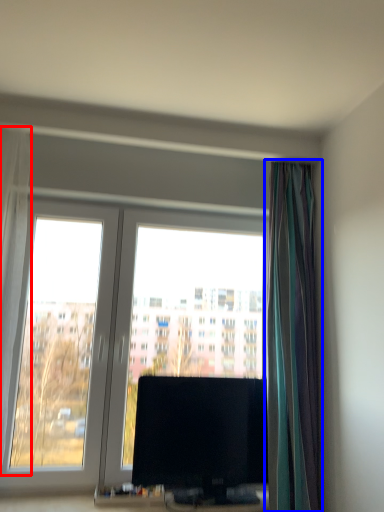
Question: Among these objects, which one is farthest to the camera, curtain (highlighted by a red box) or curtain (highlighted by a blue box)?

Choices:
 (A) curtain
 (B) curtain

Answer: (B)